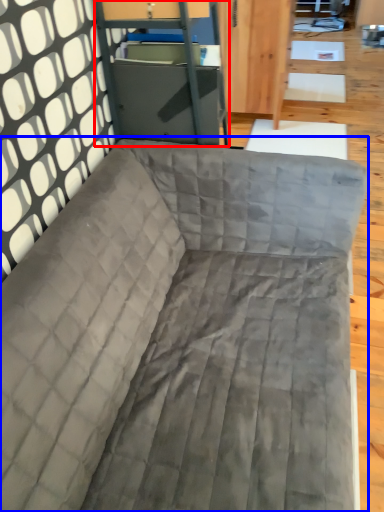
Question: Among these objects, which one is farthest to the camera, file cabinet (highlighted by a red box) or studio couch (highlighted by a blue box)?

Choices:
 (A) file cabinet
 (B) studio couch

Answer: (A)